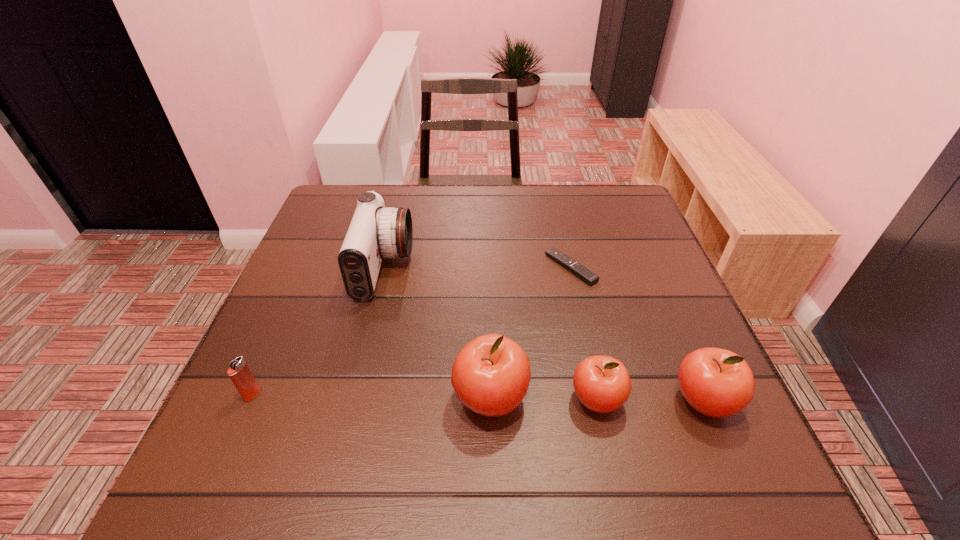
You are a GUI agent. You are given a task and a screenshot of the screen. Output one action in this format:
    pyautogui.click(x=<x>, y=<y>)
    Task: Click on the object present at the near right corner
    
    Given the screenshot: What is the action you would take?
    pyautogui.click(x=716, y=382)

In the image, there is a desktop. Where is `vacant space at the far edge`? vacant space at the far edge is located at coordinates [541, 197].

I want to click on vacant space at the near edge of the desktop, so click(x=367, y=401).

Identify the location of vacant space at the left edge of the desktop. Image resolution: width=960 pixels, height=540 pixels. (296, 263).

Where is `free point at the far left corner`? The width and height of the screenshot is (960, 540). free point at the far left corner is located at coordinates (321, 228).

In order to click on free region at the near left corner of the desktop in this screenshot , I will do `click(246, 430)`.

I want to click on free space between the leftmost apple and the third shortest object, so click(x=543, y=399).

Find the location of `vacant space in between the second object from left to right and the remote control`. vacant space in between the second object from left to right and the remote control is located at coordinates (477, 268).

The width and height of the screenshot is (960, 540). I want to click on blank region between the second tallest apple and the second apple from left to right, so click(650, 400).

Locate an element on the screen. free space between the second apple from left to right and the leftmost object is located at coordinates (424, 397).